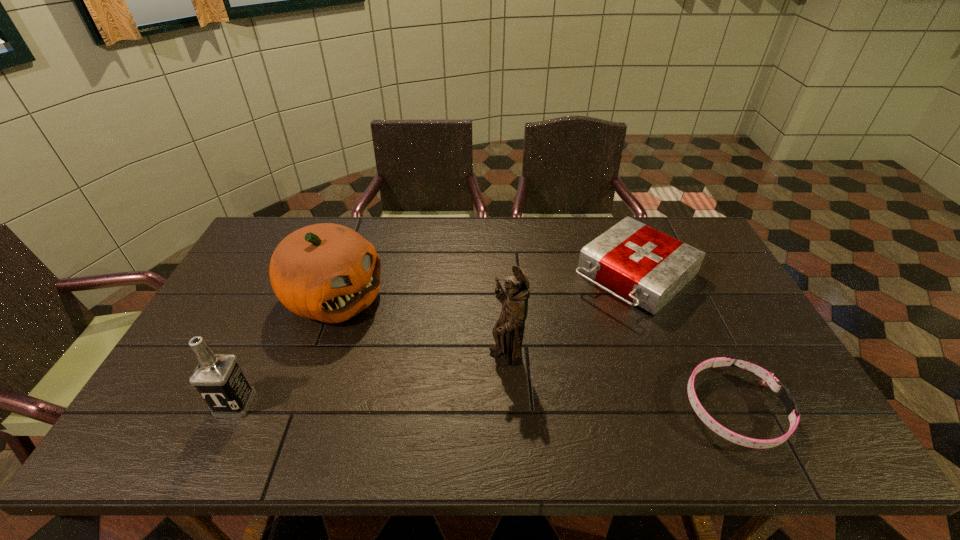
Locate an element on the screen. The height and width of the screenshot is (540, 960). the first-aid kit at the right edge is located at coordinates (648, 267).

Locate an element on the screen. Image resolution: width=960 pixels, height=540 pixels. object at the near left corner is located at coordinates (218, 378).

Find the location of a particular element. This screenshot has height=540, width=960. object at the far right corner is located at coordinates (648, 267).

What are the coordinates of `object that is at the near right corner` in the screenshot? It's located at (768, 379).

You are a GUI agent. You are given a task and a screenshot of the screen. Output one action in this format:
    pyautogui.click(x=<x>, y=<y>)
    Task: Click on the free location at the far edge of the desktop
    Image resolution: width=960 pixels, height=540 pixels.
    Given the screenshot: What is the action you would take?
    pyautogui.click(x=445, y=225)

Identify the location of vacant space at the near edge of the desktop. (298, 409).

The image size is (960, 540). Find the location of `free point at the far left corner`. free point at the far left corner is located at coordinates (248, 257).

In order to click on vacant position at the near left corner of the desktop in this screenshot , I will do `click(201, 410)`.

You are a GUI agent. You are given a task and a screenshot of the screen. Output one action in this format:
    pyautogui.click(x=<x>, y=<y>)
    Task: Click on the free spot between the second shortest object and the vodka
    The width and height of the screenshot is (960, 540).
    Given the screenshot: What is the action you would take?
    pyautogui.click(x=435, y=340)

You are a GUI agent. You are given a task and a screenshot of the screen. Output one action in this format:
    pyautogui.click(x=<x>, y=<y>)
    Task: Click on the free space between the dog collar and the vodka
    
    Given the screenshot: What is the action you would take?
    pyautogui.click(x=485, y=406)